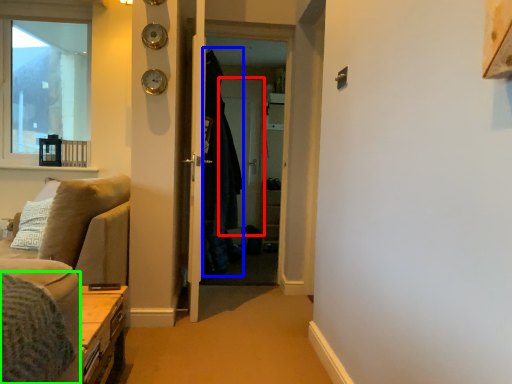
Question: Which is farther away from screen door (highlighted by a red box)? robe (highlighted by a blue box) or bedding (highlighted by a green box)?

Choices:
 (A) robe
 (B) bedding

Answer: (B)